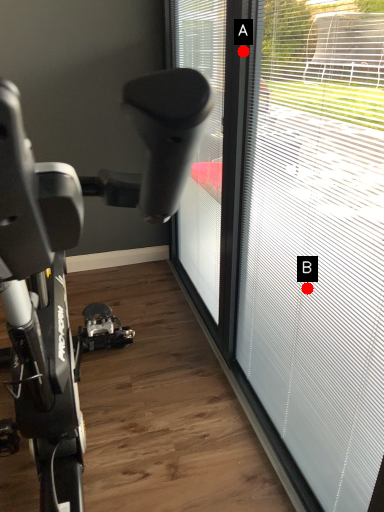
Question: Two points are circled on the image, labeled by A and B beside each circle. Which point is farther to the camera?

Choices:
 (A) A is further
 (B) B is further

Answer: (A)